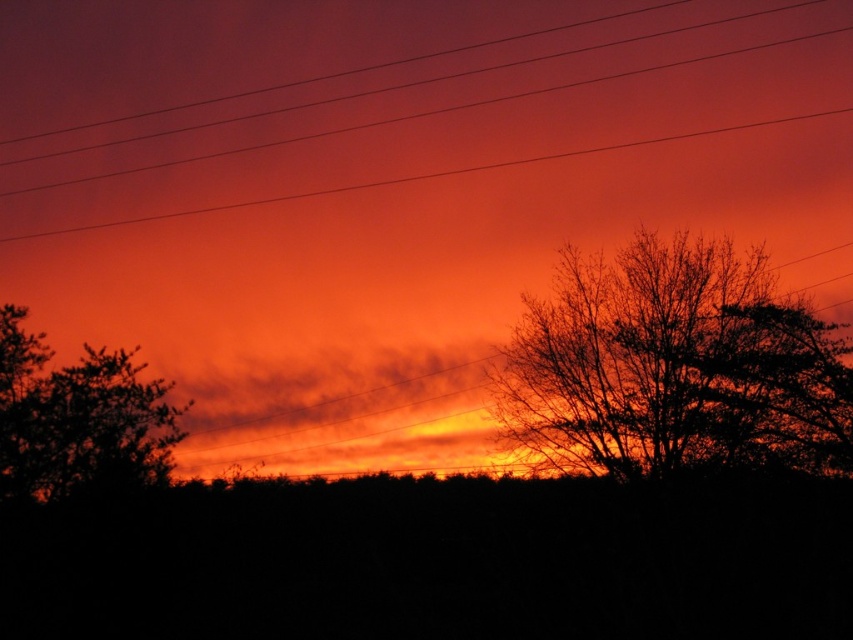
You are a bird trying to land on a perch. You see the silhouette tree at left and the smooth wire at upper center. Which one is higher up in the sky?

The smooth wire at upper center is higher up in the sky than the silhouette tree at left.

You are an ornithologist observing birds migrating south. You notice two silhouette trees in the sunset scene. Which silhouette tree is positioned higher in the sky between the silhouette tree at right and the silhouette tree at left?

The silhouette tree at right is positioned higher in the sky than the silhouette tree at left.